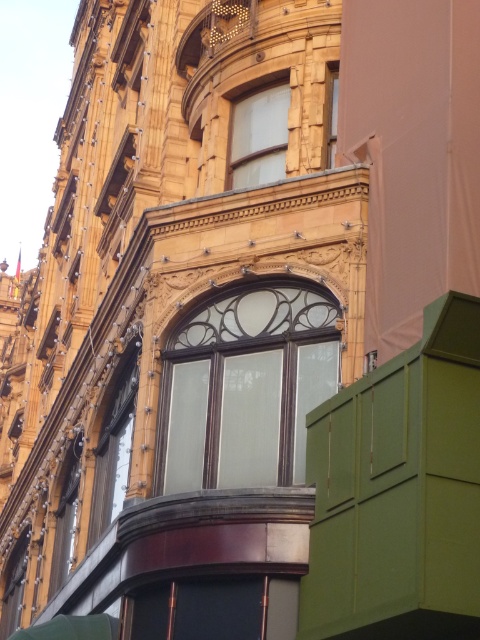
Does matte glass window at center appear on the left side of matte glass window at upper left?

No, matte glass window at center is not to the left of matte glass window at upper left.

Is point (176, 476) more distant than point (106, 419)?

No, it is in front of (106, 419).

Find the location of a particular element. The height and width of the screenshot is (640, 480). matte glass window at center is located at coordinates (245, 387).

Is the position of matte glass window at upper left more distant than that of matte glass window at lower left?

No, matte glass window at upper left is closer to the viewer.

Who is shorter, matte glass window at upper left or matte glass window at lower left?

With less height is matte glass window at lower left.

Does point (117, 422) come behind point (76, 456)?

That is False.

At what (x,y) coordinates should I click in order to perform the action: click on matte glass window at upper left. Please return your answer as a coordinate pair (x, y). The width and height of the screenshot is (480, 640). Looking at the image, I should click on (113, 449).

Does matte glass window at center have a greater height compared to clear glass window at upper center?

Yes.

Which is above, matte glass window at center or clear glass window at upper center?

clear glass window at upper center

Is point (211, 401) closer to camera compared to point (333, 161)?

Yes, point (211, 401) is in front of point (333, 161).

Find the location of `matte glass window at center`. matte glass window at center is located at coordinates (245, 387).